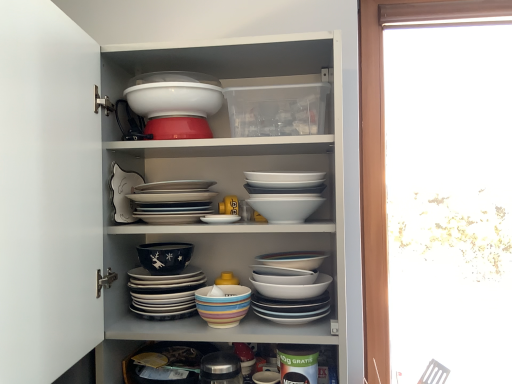
Question: Does white glossy bowl at upper center, acting as the eighth bowl starting from the bottom, turn towards white glossy bowls at center, the third bowl positioned from the top?

Choices:
 (A) no
 (B) yes

Answer: (A)

Question: Is white glossy bowl at upper center, acting as the first bowl starting from the top, located outside white glossy bowls at center, the third bowl positioned from the top?

Choices:
 (A) yes
 (B) no

Answer: (A)

Question: Is white glossy bowl at upper center, acting as the first bowl starting from the top, at the right side of white glossy bowls at center, which is the sixth bowl in bottom-to-top order?

Choices:
 (A) yes
 (B) no

Answer: (B)

Question: Is white glossy bowl at upper center, acting as the eighth bowl starting from the bottom, directly adjacent to white glossy bowls at center, the third bowl positioned from the top?

Choices:
 (A) no
 (B) yes

Answer: (A)

Question: Considering the relative positions of white glossy bowl at upper center, acting as the first bowl starting from the top, and white glossy bowls at center, which is the sixth bowl in bottom-to-top order, in the image provided, is white glossy bowl at upper center, acting as the first bowl starting from the top, to the left of white glossy bowls at center, which is the sixth bowl in bottom-to-top order, from the viewer's perspective?

Choices:
 (A) no
 (B) yes

Answer: (B)

Question: From a real-world perspective, is white glossy bowls at upper center above or below white glossy bowl at upper center, acting as the first bowl starting from the top?

Choices:
 (A) above
 (B) below

Answer: (B)

Question: In the image, is white glossy bowls at upper center positioned in front of or behind white glossy bowl at upper center, acting as the first bowl starting from the top?

Choices:
 (A) behind
 (B) front

Answer: (B)

Question: From the image's perspective, is white glossy bowls at upper center above or below white glossy bowl at upper center, acting as the eighth bowl starting from the bottom?

Choices:
 (A) below
 (B) above

Answer: (A)

Question: Is point (3, 206) positioned closer to the camera than point (174, 104)?

Choices:
 (A) closer
 (B) farther

Answer: (A)

Question: Is point (150, 11) positioned closer to the camera than point (146, 134)?

Choices:
 (A) farther
 (B) closer

Answer: (A)

Question: From a real-world perspective, is white glossy bowls at upper center positioned above or below matte red bowl at upper center, which ranks as the seventh bowl in bottom-to-top order?

Choices:
 (A) above
 (B) below

Answer: (B)

Question: Considering the positions of white glossy bowls at upper center and matte red bowl at upper center, which ranks as the seventh bowl in bottom-to-top order, in the image, is white glossy bowls at upper center wider or thinner than matte red bowl at upper center, which ranks as the seventh bowl in bottom-to-top order,?

Choices:
 (A) thin
 (B) wide

Answer: (B)

Question: From their relative heights in the image, would you say white glossy bowls at upper center is taller or shorter than matte red bowl at upper center, marked as the 2th bowl in a top-to-bottom arrangement?

Choices:
 (A) tall
 (B) short

Answer: (A)

Question: Is white glossy bowls at center, the third bowl positioned from the top, wider or thinner than white glossy plate at center, positioned as the fourth bowl in top-to-bottom order?

Choices:
 (A) wide
 (B) thin

Answer: (B)

Question: From their relative heights in the image, would you say white glossy bowls at center, the third bowl positioned from the top, is taller or shorter than white glossy plate at center, positioned as the fourth bowl in top-to-bottom order?

Choices:
 (A) tall
 (B) short

Answer: (A)